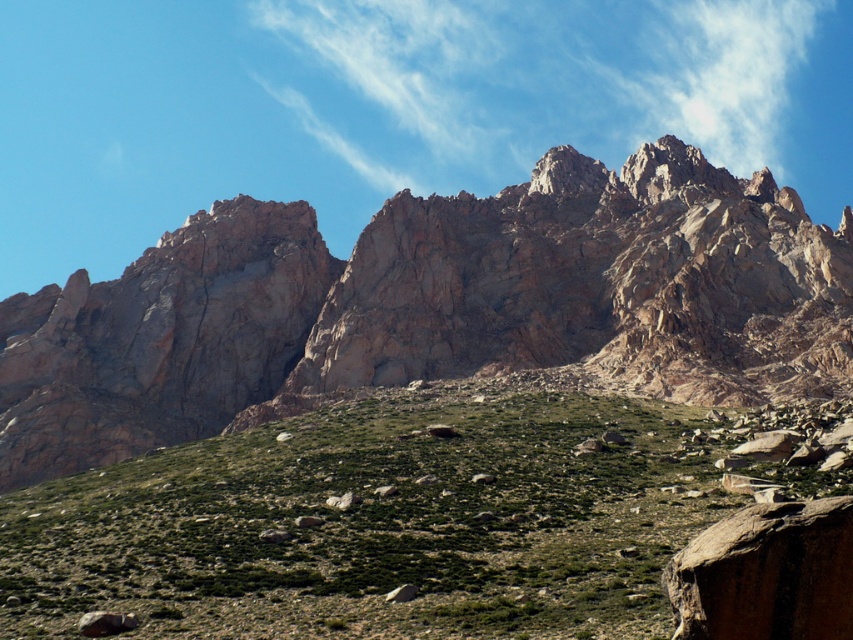
You are planning a hiking route and need to decide between two paths. One path leads through the rugged rock mountain range at upper center, and the other goes across the green grassy hillside at lower center. Based on the terrain described, which path would likely be more challenging in terms of width and space?

The rugged rock mountain range at upper center might be wider than the green grassy hillside at lower center, so the path through the rugged rock mountain range at upper center could be more challenging due to its potentially wider terrain requiring more navigation around obstacles.

You are a hiker standing at point (135, 540) and want to reach point (85, 465). Which direction should you move in to get closer to your destination?

You should move backward because point (85, 465) is behind point (135, 540).

Looking at this image, you are a hiker planning to take a photo of the rugged rock mountain range at upper center and the green grassy hillside at lower center. Which of these two landmarks appears bigger in the image?

The rugged rock mountain range at upper center appears bigger in the image compared to the green grassy hillside at lower center because it has a larger size according to the description.